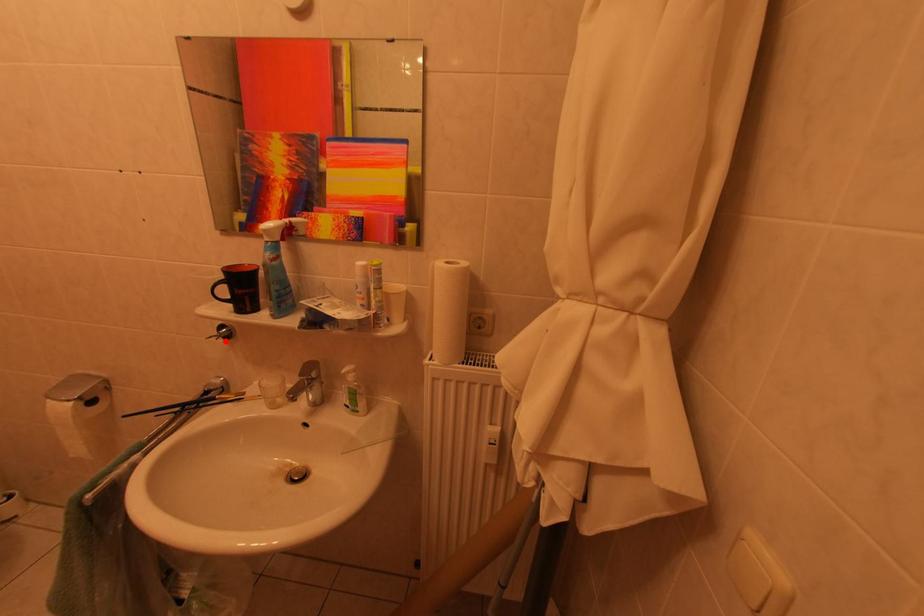
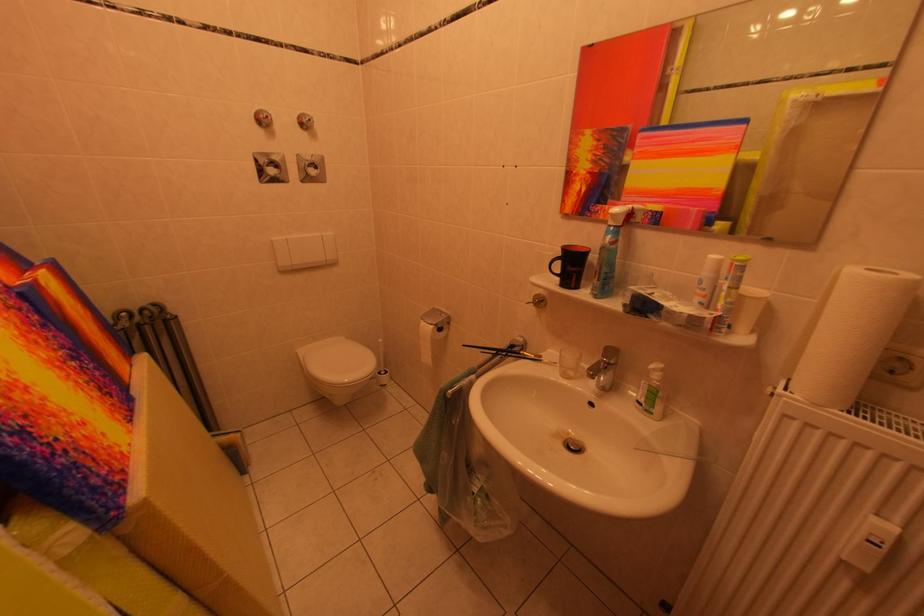
Question: I am providing you with two images of the same scene from different viewpoints. A red point is marked on the first image. Is the red point's position out of view in image 2?

Choices:
 (A) Yes
 (B) No

Answer: (B)